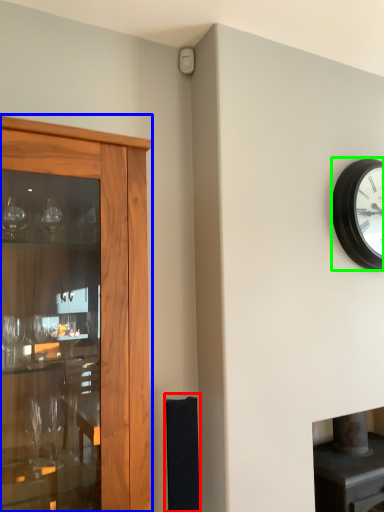
Question: Which is nearer to the speaker (highlighted by a red box)? cupboard (highlighted by a blue box) or wall clock (highlighted by a green box).

Choices:
 (A) cupboard
 (B) wall clock

Answer: (A)